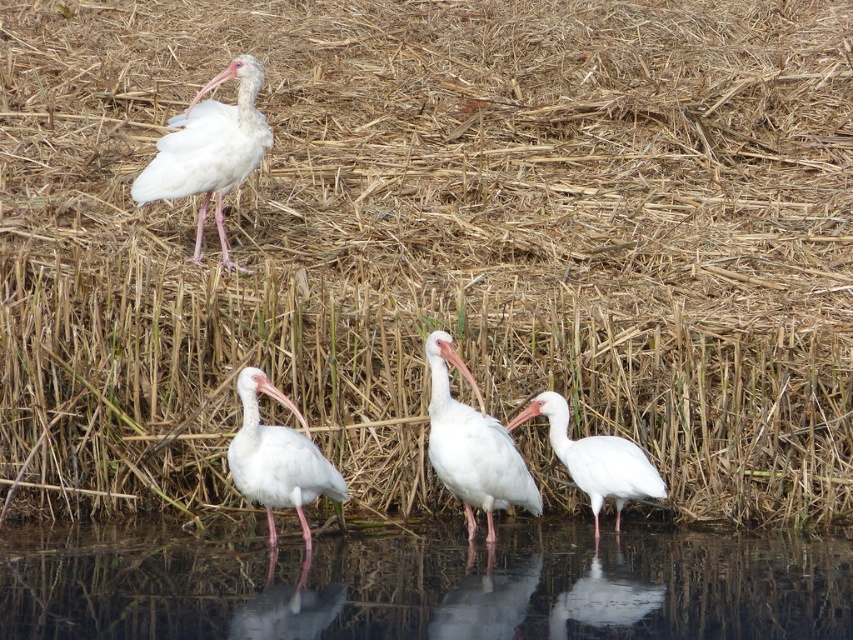
Question: Which of these objects is positioned farthest from the white matte bird at lower center?

Choices:
 (A) white matte ibis at upper left
 (B) white matte bird at center

Answer: (A)

Question: From the image, what is the correct spatial relationship of white matte ibis at upper left in relation to white matte bird at lower center?

Choices:
 (A) below
 (B) above

Answer: (B)

Question: Which point is farther to the camera?

Choices:
 (A) (230, 113)
 (B) (558, 452)
 (C) (270, 534)
 (D) (244, 609)

Answer: (A)

Question: Where is white matte ibis at lower center located in relation to white matte bird at lower center in the image?

Choices:
 (A) right
 (B) left

Answer: (B)

Question: In this image, where is white matte ibis at upper left located relative to white matte bird at center?

Choices:
 (A) right
 (B) left

Answer: (B)

Question: Which of these objects is positioned farthest from the white matte bird at lower center?

Choices:
 (A) white matte ibis at upper left
 (B) white matte ibis at lower center
 (C) white matte bird at center
 (D) transparent water at lower center

Answer: (A)